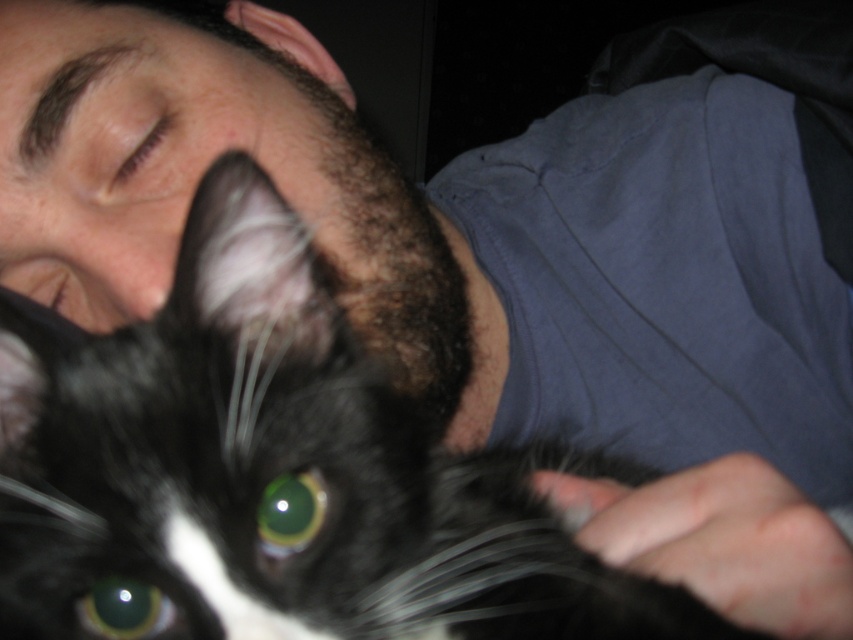
Between point (270, 433) and point (287, 545), which one is positioned behind?

Positioned behind is point (270, 433).

Can you confirm if black fur cat at center is smaller than green glossy eye at center?

Actually, black fur cat at center might be larger than green glossy eye at center.

This screenshot has width=853, height=640. Describe the element at coordinates (280, 470) in the screenshot. I see `black fur cat at center` at that location.

Find the location of a particular element. black fur cat at center is located at coordinates (280, 470).

Between black fur at center and green glossy eye at lower left, which one has less height?

Standing shorter between the two is green glossy eye at lower left.

Between point (422, 340) and point (157, 612), which one is positioned in front?

Point (157, 612)

Describe the element at coordinates (204, 170) in the screenshot. I see `black fur at center` at that location.

Image resolution: width=853 pixels, height=640 pixels. Identify the location of black fur at center. (204, 170).

Does black fur cat at center have a larger size compared to brown fur at upper left?

Correct, black fur cat at center is larger in size than brown fur at upper left.

Is black fur cat at center further to the viewer compared to brown fur at upper left?

That is False.

The width and height of the screenshot is (853, 640). Describe the element at coordinates (280, 470) in the screenshot. I see `black fur cat at center` at that location.

The width and height of the screenshot is (853, 640). I want to click on black fur cat at center, so click(x=280, y=470).